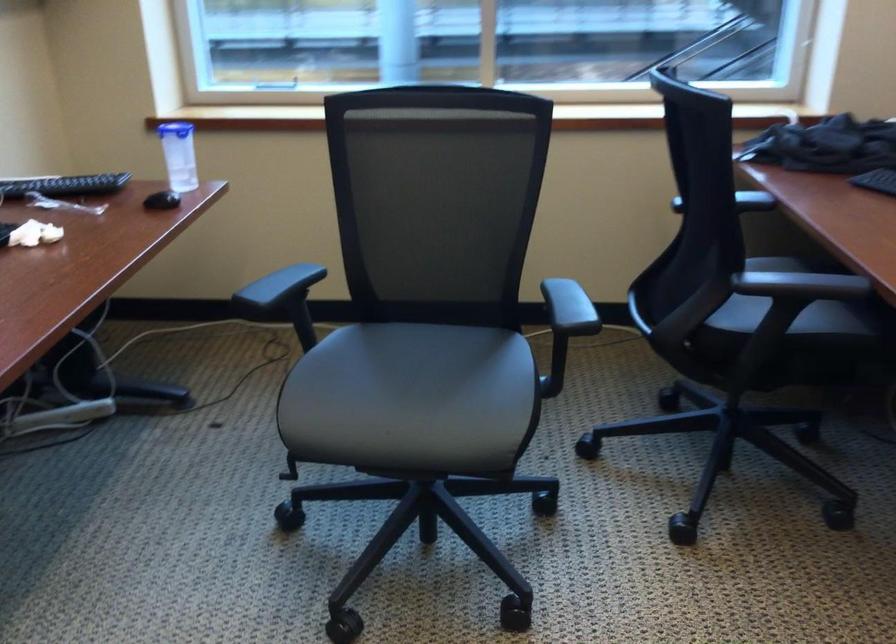
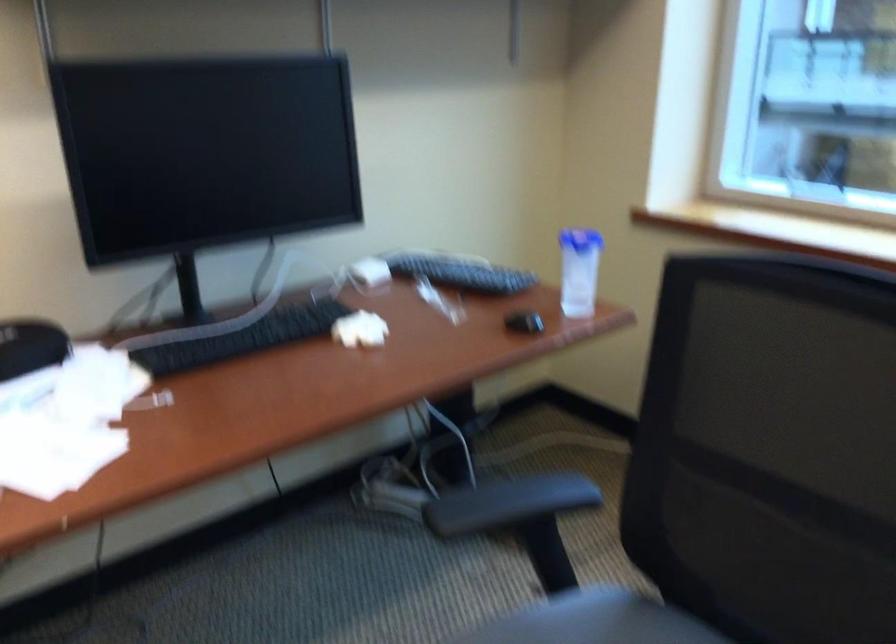
Where in the second image is the point corresponding to [192,192] from the first image?

(523, 322)